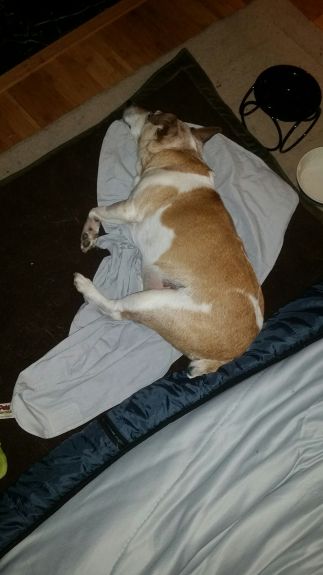
Where is `edge of wooden floor`? edge of wooden floor is located at coordinates (98, 26).